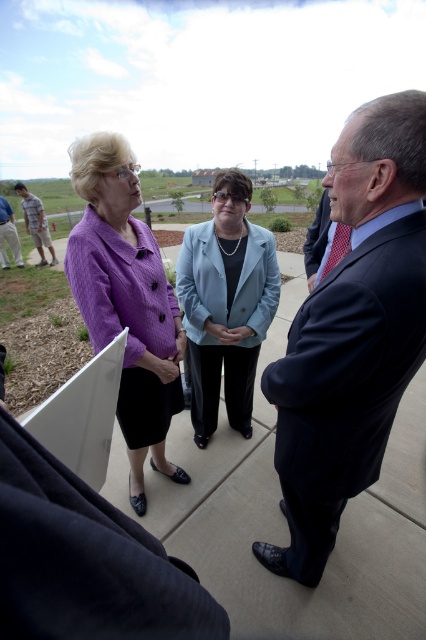
You are a tailor observing the two garments worn by the women in the center of the image. Which garment has a greater height between the dark blue suit at center and the light blue fabric jacket at center?

The dark blue suit at center has a greater height compared to the light blue fabric jacket at center.

Based on the scene description, where is the dark blue suit at center located in terms of its 2D coordinates?

The dark blue suit at center is located at the 2D coordinates of point (351, 333).